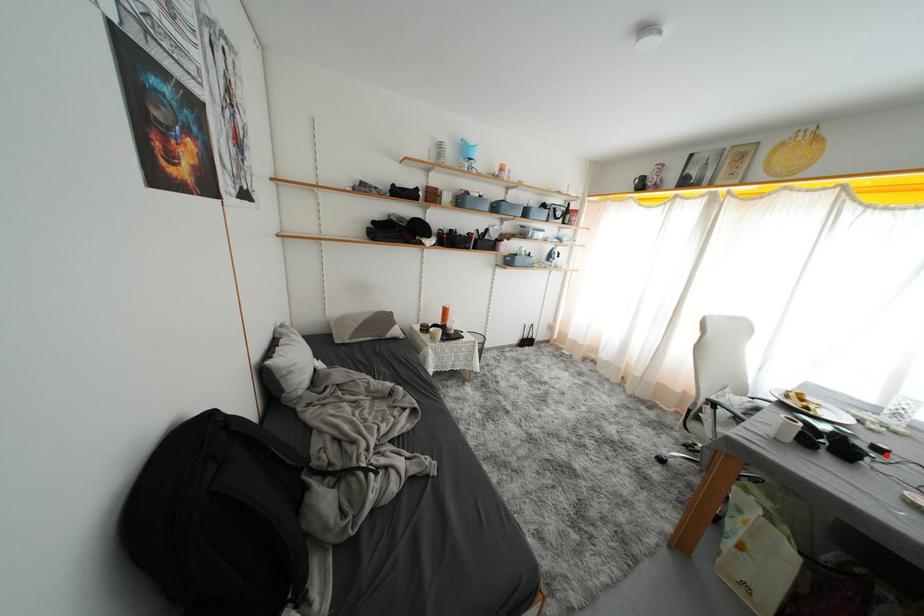
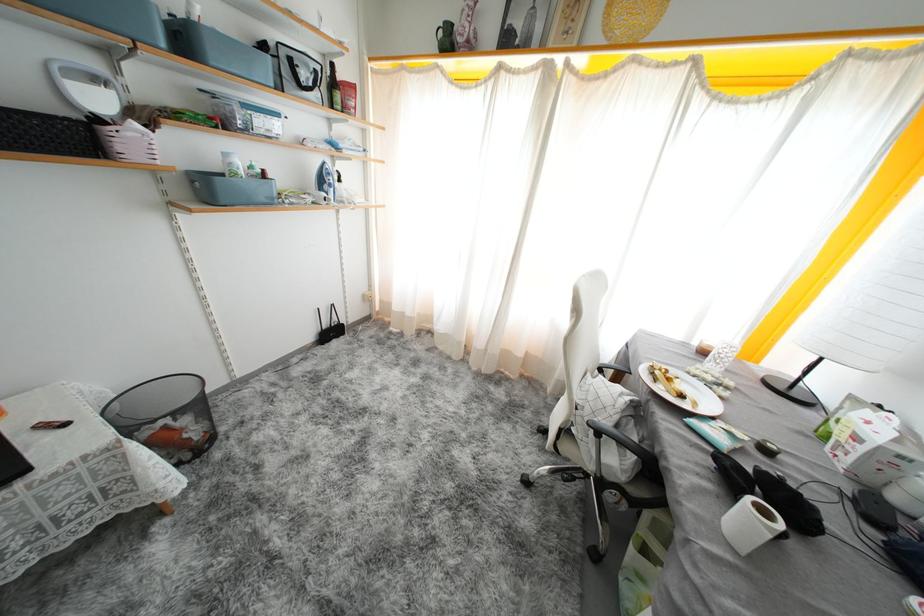
Question: A red point is marked in image1. In image2, is the corresponding 3D point closer to the camera or farther? Reply with the corresponding letter.

Choices:
 (A) The corresponding 3D point is closer.
 (B) The corresponding 3D point is farther.

Answer: (A)